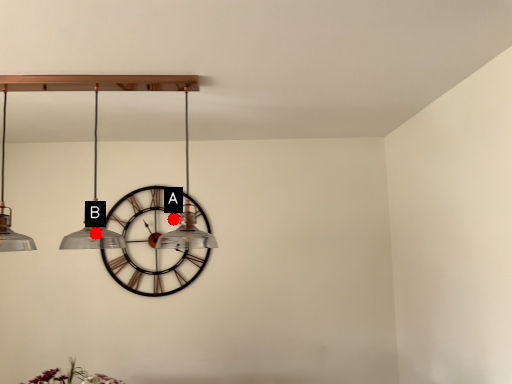
Question: Two points are circled on the image, labeled by A and B beside each circle. Which point is farther to the camera?

Choices:
 (A) A is further
 (B) B is further

Answer: (A)